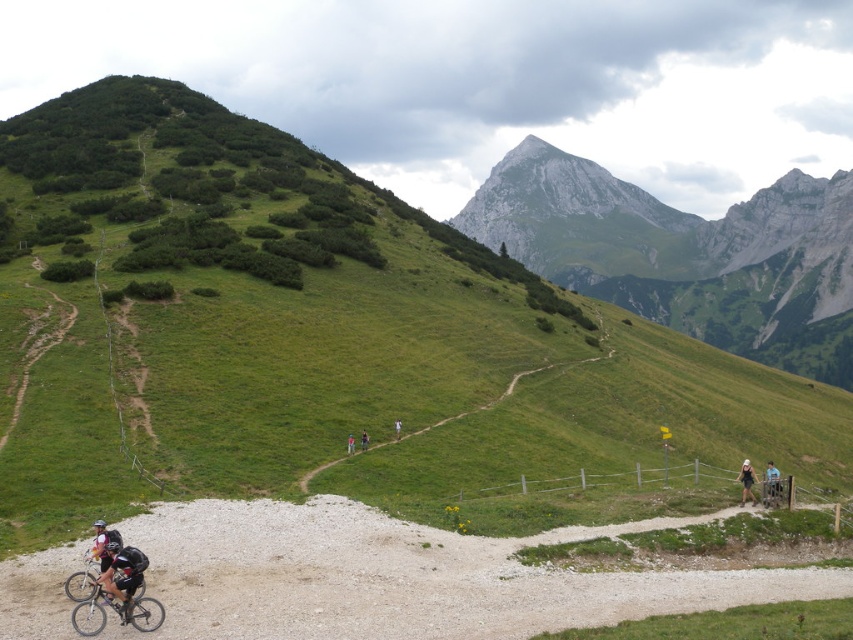
Does point (239, 536) lie in front of point (769, 488)?

Yes, it is in front of point (769, 488).

Between point (724, 580) and point (779, 490), which one is positioned behind?

The point (779, 490) is more distant.

This screenshot has width=853, height=640. What are the coordinates of `gravelly dirt track at lower left` in the screenshot? It's located at (409, 576).

Can you confirm if rugged stone mountain at upper center is shorter than white fabric person at center?

In fact, rugged stone mountain at upper center may be taller than white fabric person at center.

Does rugged stone mountain at upper center have a greater height compared to white fabric person at center?

Yes, rugged stone mountain at upper center is taller than white fabric person at center.

This screenshot has width=853, height=640. In order to click on rugged stone mountain at upper center in this screenshot , I will do `click(686, 253)`.

Between point (747, 496) and point (103, 520), which one is positioned in front?

Point (103, 520) is more forward.

Which is more to the right, white fabric dress at lower right or black matte bicycle helmet at lower left?

Positioned to the right is white fabric dress at lower right.

Which is in front, point (747, 490) or point (97, 525)?

Point (97, 525) is in front.

Locate an element on the screen. This screenshot has height=640, width=853. white fabric dress at lower right is located at coordinates (746, 483).